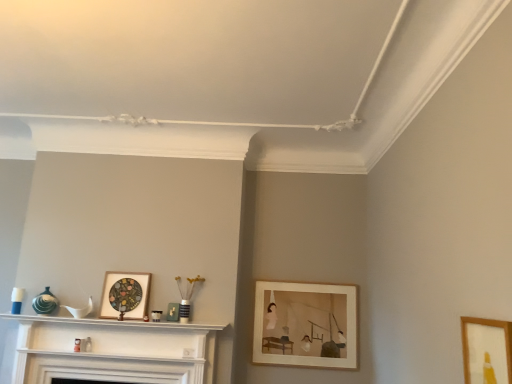
Question: Does wooden picture frame at center-right, the 2th picture frame from the right, have a lesser height compared to white glossy fireplace at center?

Choices:
 (A) no
 (B) yes

Answer: (A)

Question: Is wooden picture frame at center-right, the first picture frame when ordered from back to front, with white glossy fireplace at center?

Choices:
 (A) yes
 (B) no

Answer: (B)

Question: Is wooden picture frame at center-right, which ranks as the second picture frame in left-to-right order, wider than white glossy fireplace at center?

Choices:
 (A) no
 (B) yes

Answer: (A)

Question: Is wooden picture frame at center-right, the 2th picture frame from the right, behind white glossy fireplace at center?

Choices:
 (A) yes
 (B) no

Answer: (A)

Question: Is wooden picture frame at center-right, which ranks as the second picture frame in left-to-right order, facing away from white glossy fireplace at center?

Choices:
 (A) yes
 (B) no

Answer: (B)

Question: In the image, is wooden picture frame at center-right, acting as the 3th picture frame starting from the front, positioned in front of or behind wooden stained picture frame at center, placed as the 3th picture frame when sorted from right to left?

Choices:
 (A) behind
 (B) front

Answer: (A)

Question: Is wooden picture frame at center-right, acting as the 3th picture frame starting from the front, situated inside wooden stained picture frame at center, the second picture frame from the back, or outside?

Choices:
 (A) outside
 (B) inside

Answer: (A)

Question: From their relative heights in the image, would you say wooden picture frame at center-right, acting as the 3th picture frame starting from the front, is taller or shorter than wooden stained picture frame at center, placed as the 3th picture frame when sorted from right to left?

Choices:
 (A) tall
 (B) short

Answer: (A)

Question: Would you say wooden picture frame at center-right, the first picture frame when ordered from back to front, is to the left or to the right of wooden stained picture frame at center, marked as the first picture frame in a left-to-right arrangement, in the picture?

Choices:
 (A) right
 (B) left

Answer: (A)

Question: In the image, is wooden picture frame at lower right, which is counted as the third picture frame, starting from the left, on the left side or the right side of white glossy fireplace at center?

Choices:
 (A) left
 (B) right

Answer: (B)

Question: Considering the positions of wooden picture frame at lower right, which is counted as the third picture frame, starting from the left, and white glossy fireplace at center in the image, is wooden picture frame at lower right, which is counted as the third picture frame, starting from the left, bigger or smaller than white glossy fireplace at center?

Choices:
 (A) big
 (B) small

Answer: (B)

Question: From the image's perspective, is wooden picture frame at lower right, which is counted as the third picture frame, starting from the left, above or below white glossy fireplace at center?

Choices:
 (A) above
 (B) below

Answer: (A)

Question: Considering the positions of point (489, 380) and point (99, 319), is point (489, 380) closer or farther from the camera than point (99, 319)?

Choices:
 (A) farther
 (B) closer

Answer: (B)

Question: Relative to wooden stained picture frame at center, the second picture frame from the back, is wooden picture frame at lower right, which is counted as the third picture frame, starting from the left, in front or behind?

Choices:
 (A) front
 (B) behind

Answer: (A)

Question: Is wooden picture frame at lower right, placed as the third picture frame when sorted from back to front, bigger or smaller than wooden stained picture frame at center, placed as the 3th picture frame when sorted from right to left?

Choices:
 (A) small
 (B) big

Answer: (A)